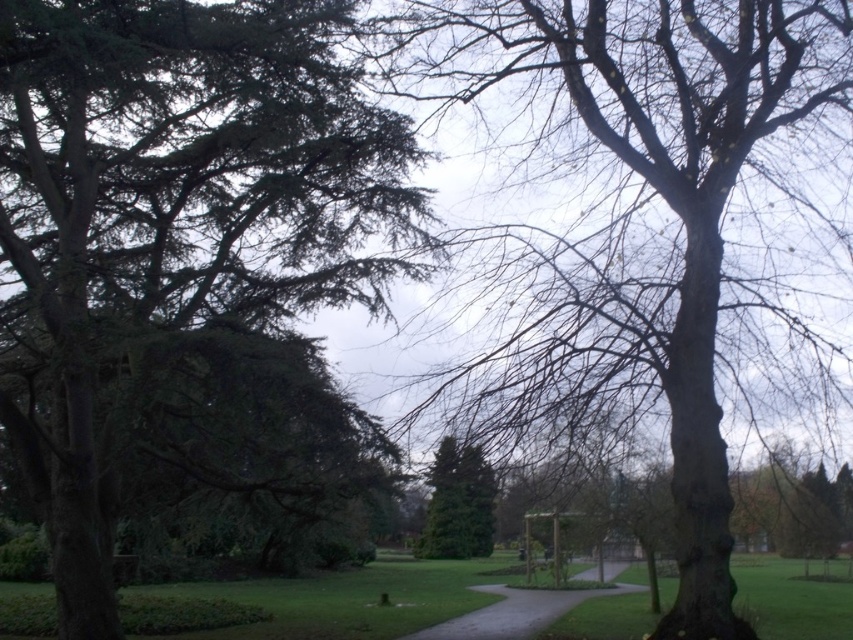
Question: Which of the following is the closest to the observer?

Choices:
 (A) green needle-like leaves at left
 (B) smooth bark tree at center
 (C) smooth asphalt path at center

Answer: (A)

Question: From the image, what is the correct spatial relationship of green needle-like leaves at left in relation to green textured tree at center?

Choices:
 (A) right
 (B) left

Answer: (B)

Question: Which of the following is the closest to the observer?

Choices:
 (A) (451, 448)
 (B) (728, 509)

Answer: (B)

Question: Considering the real-world distances, which object is closest to the smooth asphalt path at center?

Choices:
 (A) smooth bark tree at center
 (B) green textured tree at center

Answer: (B)

Question: Can you confirm if green needle-like leaves at left is smaller than green textured tree at center?

Choices:
 (A) yes
 (B) no

Answer: (B)

Question: Considering the relative positions of smooth bark tree at center and green needle-like leaves at left in the image provided, where is smooth bark tree at center located with respect to green needle-like leaves at left?

Choices:
 (A) below
 (B) above

Answer: (B)